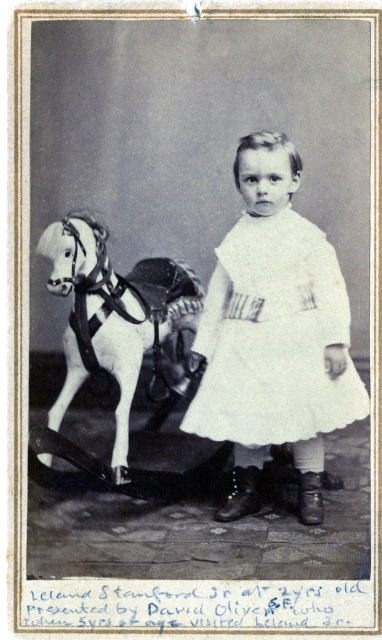
Based on the scene description, where is the white cotton dress at center positioned in relation to the child and the wooden rocking horse?

The white cotton dress at center is located at point (273, 337), which places it at the center of the image, between the child and the wooden rocking horse positioned behind and to the left.

You are a photographer analyzing the composition of this vintage portrait. You notice a point at coordinates (273, 337). Based on the scene, what object is located at this point?

The point at coordinates (273, 337) marks the white cotton dress at center.